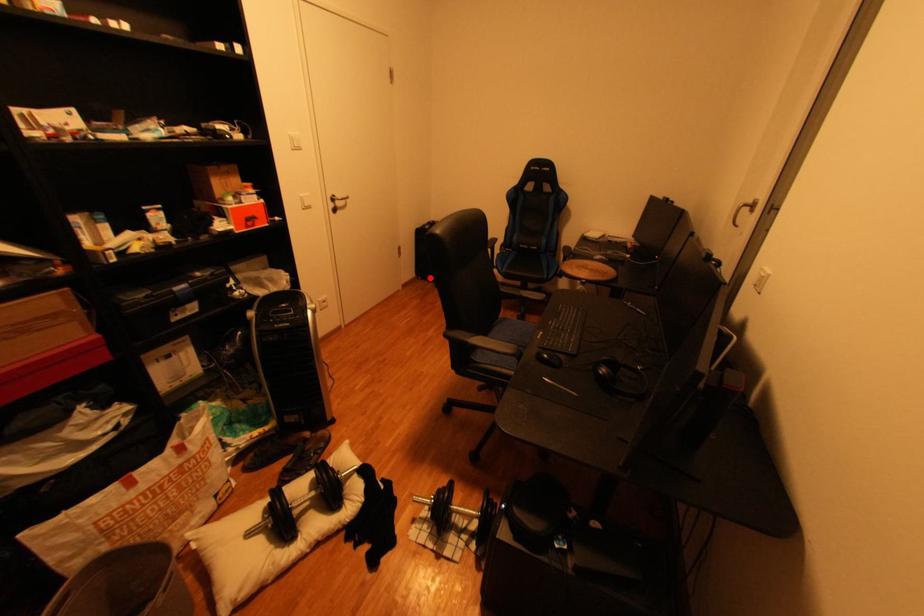
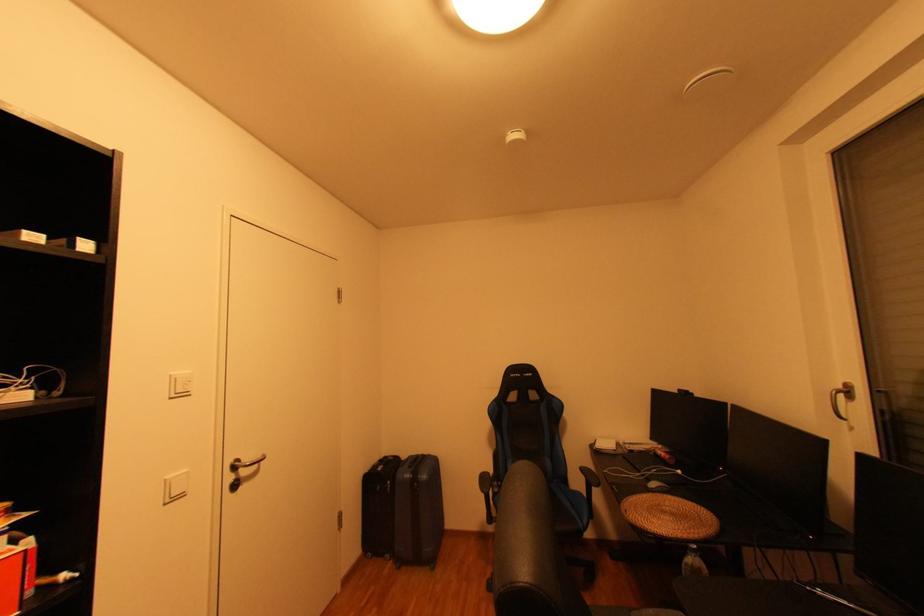
In the second image, find the point that corresponds to the highlighted location in the first image.

(380, 554)